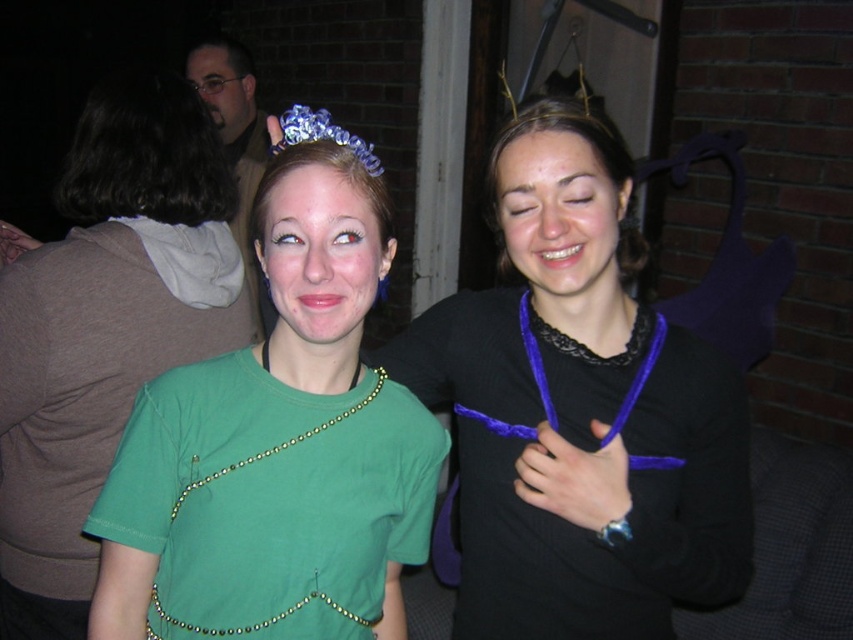
Question: Which of these objects is positioned farthest from the purple velvet lanyard at center?

Choices:
 (A) matte black face at upper left
 (B) matte purple necklace at center
 (C) green fabric dress at center
 (D) gold beaded lanyard at center

Answer: (A)

Question: Does matte purple necklace at center appear over green fabric necklace at center?

Choices:
 (A) yes
 (B) no

Answer: (A)

Question: Which object is closer to the camera taking this photo?

Choices:
 (A) green fabric face at center
 (B) purple fabric necklace at center

Answer: (A)

Question: Which point is closer to the camera taking this photo?

Choices:
 (A) (204, 88)
 (B) (35, 412)

Answer: (B)

Question: Is green fabric face at center above matte black face at upper left?

Choices:
 (A) no
 (B) yes

Answer: (A)

Question: Can you confirm if purple velvet necklace at center is positioned above purple velvet lanyard at center?

Choices:
 (A) yes
 (B) no

Answer: (B)